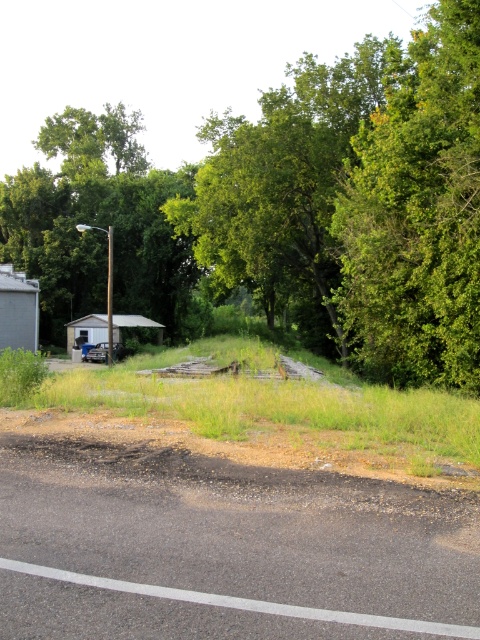
You are a photographer planning to capture a sunset shot from the road. You have a camera that can only focus on objects up to 10 meters tall. The green leafy tree at upper right and the rusty metal trailer at center are in your frame. Will both objects be in focus?

The green leafy tree at upper right is taller than the rusty metal trailer at center. Since the tree is taller than 10 meters, it might be out of focus, but the trailer, being shorter, would likely be in focus. However, without knowing the exact height of the trailer, we can only confirm the tree may exceed the focus limit.

You are a landscape architect planning to install a new bench between the green leafy tree at upper center and the green leafy tree at upper right. Given that the bench requires at least 8 meters of space between the two trees to be placed comfortably, will there be enough space?

The green leafy tree at upper center and green leafy tree at upper right are 9.46 meters apart, which is more than the required 8 meters, so there is enough space to place the bench comfortably between them.

You are a drone operator planning to fly a drone from the green leafy tree at upper center to the road edge marked by the white line. According to the coordinates provided, will the drone have to fly over the road or can it stay above the road edge?

The green leafy tree at upper center is located at coordinates point (301,209). Since the road edge is marked by the white line, the drone would need to fly over the road to reach it from the tree, as the coordinates place the tree above the road area.